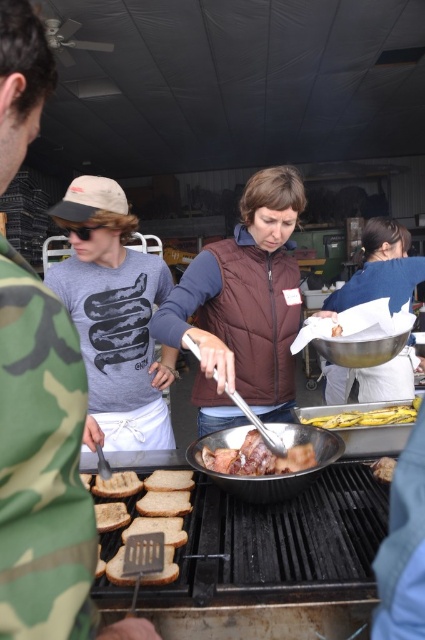
Consider the image. You are organizing a small outdoor event and need to arrange items on a table. You have the brown puffy vest at center and the shiny metallic pan at center. If you want to place both items side by side on a table that can only accommodate items up to the width of the brown puffy vest, will they fit?

The brown puffy vest at center might be wider than the shiny metallic pan at center. Since the table can only accommodate items up to the width of the brown puffy vest, the shiny metallic pan at center should fit alongside it as long as their combined width does not exceed the table capacity. However, without exact measurements, this is uncertain.

You are a food safety inspector checking the kitchen. You notice the brown puffy vest at center and the yellow rubber gloves at center. According to health regulations, the minimum required distance between clothing and food preparation areas is 12 inches. Is the current distance compliant?

The distance between the brown puffy vest at center and the yellow rubber gloves at center is 15.48 inches, which exceeds the 12 inches requirement. Therefore, the current distance is compliant with health regulations.

You are a photographer at the event and want to capture a photo of the brown puffy vest at center and the yellow rubber gloves at center. Which object should you focus on first if you want to include both in the frame without moving the camera?

The brown puffy vest at center is positioned on the left side of yellow rubber gloves at center, so you should focus on the brown puffy vest at center first to include both in the frame without moving the camera.